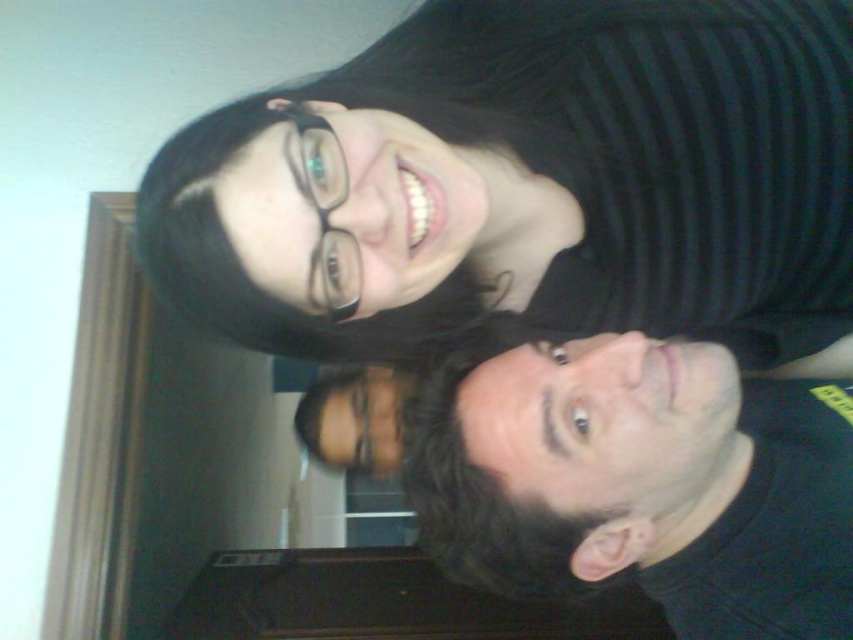
You are trying to identify which object is nearer to you in the image. The scene shows two people in a room with a door frame on the left. You see a black striped shirt at upper center and a black matte face at lower right. Which object is closer to you?

The black striped shirt at upper center is closer to the viewer than the black matte face at lower right.

You are trying to identify the positions of the black striped shirt at upper center and the black matte face at lower right in the selfie. Based on the scene description, which object is positioned to the left of the other?

The black striped shirt at upper center is to the left of the black matte face at lower right according to the description.